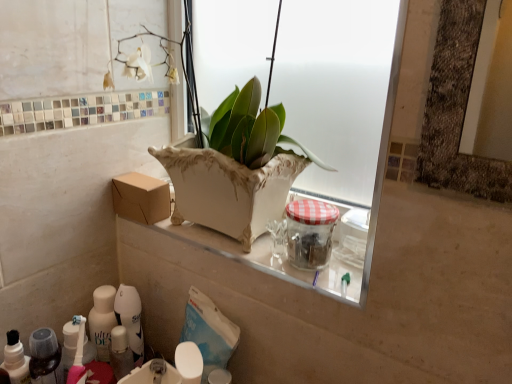
Question: From a real-world perspective, is white glossy sink at lower center physically below clear glass jar with red checkered lid at center?

Choices:
 (A) yes
 (B) no

Answer: (A)

Question: Does white glossy sink at lower center come in front of clear glass jar with red checkered lid at center?

Choices:
 (A) yes
 (B) no

Answer: (B)

Question: Can you confirm if white glossy sink at lower center is shorter than clear glass jar with red checkered lid at center?

Choices:
 (A) yes
 (B) no

Answer: (A)

Question: From the image's perspective, is white glossy sink at lower center located beneath clear glass jar with red checkered lid at center?

Choices:
 (A) yes
 (B) no

Answer: (A)

Question: Is white glossy sink at lower center completely or partially outside of clear glass jar with red checkered lid at center?

Choices:
 (A) yes
 (B) no

Answer: (A)

Question: From the image's perspective, is brown cardboard box at center above or below white glossy toothpaste tube at lower left?

Choices:
 (A) below
 (B) above

Answer: (B)

Question: Considering the positions of brown cardboard box at center and white glossy toothpaste tube at lower left in the image, is brown cardboard box at center wider or thinner than white glossy toothpaste tube at lower left?

Choices:
 (A) thin
 (B) wide

Answer: (B)

Question: In the image, is brown cardboard box at center positioned in front of or behind white glossy toothpaste tube at lower left?

Choices:
 (A) front
 (B) behind

Answer: (B)

Question: From their relative heights in the image, would you say brown cardboard box at center is taller or shorter than white glossy toothpaste tube at lower left?

Choices:
 (A) short
 (B) tall

Answer: (A)

Question: From the image's perspective, is white glossy sink at lower center positioned above or below clear glass jar with red checkered lid at center?

Choices:
 (A) above
 (B) below

Answer: (B)

Question: Is white glossy sink at lower center taller or shorter than clear glass jar with red checkered lid at center?

Choices:
 (A) tall
 (B) short

Answer: (B)

Question: Relative to clear glass jar with red checkered lid at center, is white glossy sink at lower center in front or behind?

Choices:
 (A) behind
 (B) front

Answer: (A)

Question: Would you say white glossy sink at lower center is to the left or to the right of clear glass jar with red checkered lid at center in the picture?

Choices:
 (A) right
 (B) left

Answer: (B)

Question: Looking at their shapes, would you say white glossy sink at lower center is wider or thinner than white glossy toothpaste tube at lower left?

Choices:
 (A) wide
 (B) thin

Answer: (A)

Question: Would you say white glossy sink at lower center is inside or outside white glossy toothpaste tube at lower left?

Choices:
 (A) outside
 (B) inside

Answer: (A)